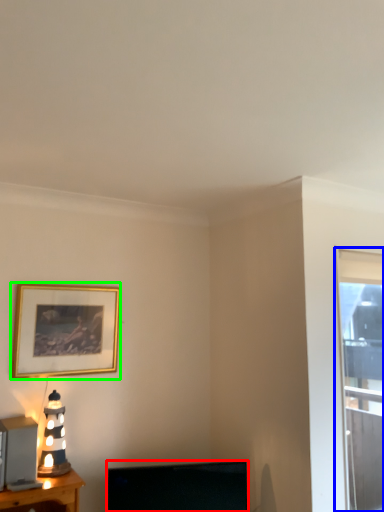
Question: Which object is the farthest from television (highlighted by a red box)? Choose among these: window (highlighted by a blue box) or picture frame (highlighted by a green box).

Choices:
 (A) window
 (B) picture frame

Answer: (A)